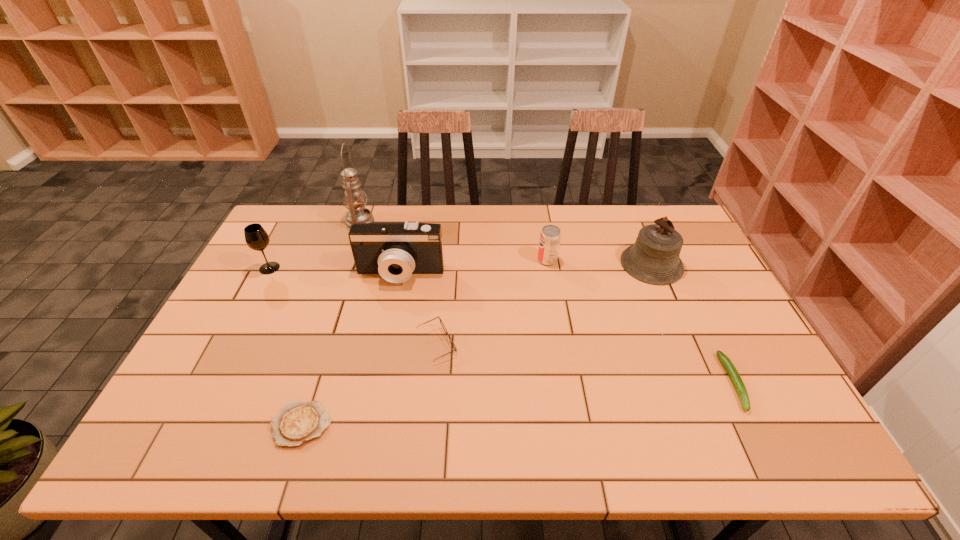
I want to click on the tallest object, so click(354, 197).

Where is `the farthest object`? This screenshot has height=540, width=960. the farthest object is located at coordinates (354, 197).

At what (x,y) coordinates should I click in order to perform the action: click on bell. Please return your answer as a coordinate pair (x, y). The image size is (960, 540). Looking at the image, I should click on (654, 258).

Find the location of a particular element. camcorder is located at coordinates (395, 250).

This screenshot has height=540, width=960. I want to click on the leftmost object, so click(256, 237).

The width and height of the screenshot is (960, 540). What are the coordinates of `the fourth shortest object` in the screenshot? It's located at pos(550,236).

Identify the location of the third object from right to left. (550, 236).

The image size is (960, 540). I want to click on the third shortest object, so click(x=441, y=322).

Where is `zucchini`? This screenshot has width=960, height=540. zucchini is located at coordinates [741, 390].

Find the location of `the shortest object`. the shortest object is located at coordinates (298, 422).